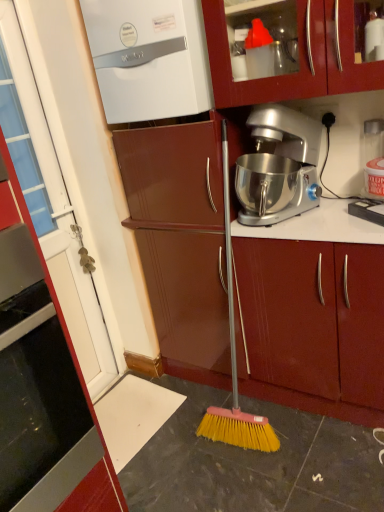
You are a GUI agent. You are given a task and a screenshot of the screen. Output one action in this format:
    pyautogui.click(x=<x>, y=<y>)
    Task: Click on the silver metallic stand mixer at center
    
    Given the screenshot: What is the action you would take?
    pyautogui.click(x=278, y=166)

The width and height of the screenshot is (384, 512). What do you see at coordinates (315, 325) in the screenshot?
I see `matte wood cabinet at center, placed as the 1th cabinetry when sorted from back to front` at bounding box center [315, 325].

This screenshot has height=512, width=384. I want to click on white glossy boiler at upper left, so click(149, 58).

Image resolution: width=384 pixels, height=512 pixels. I want to click on silver metallic stand mixer at center, so click(278, 166).

Is white glossy boiler at upper left oriented away from matte wood cabinet at center, the second cabinetry from the front?

No.

In the scene shown: Which of these two, white glossy boiler at upper left or matte wood cabinet at center, the first cabinetry in the right-to-left sequence, is thinner?

Thinner between the two is white glossy boiler at upper left.

From a real-world perspective, is white glossy boiler at upper left under matte wood cabinet at center, placed as the 1th cabinetry when sorted from back to front?

Actually, white glossy boiler at upper left is physically above matte wood cabinet at center, placed as the 1th cabinetry when sorted from back to front, in the real world.

Which object is wider, white glossy boiler at upper left or silver metallic stand mixer at center?

silver metallic stand mixer at center is wider.

From the image's perspective, which is above, white glossy boiler at upper left or silver metallic stand mixer at center?

white glossy boiler at upper left appears higher in the image.

What's the angular difference between white glossy boiler at upper left and silver metallic stand mixer at center's facing directions?

The angle between the facing direction of white glossy boiler at upper left and the facing direction of silver metallic stand mixer at center is 0.0707 degrees.

Is point (166, 15) positioned after point (268, 185)?

That is False.

From a real-world perspective, is matte wood cabinet at center, placed as the 1th cabinetry when sorted from back to front, above or below white glossy boiler at upper left?

matte wood cabinet at center, placed as the 1th cabinetry when sorted from back to front, is below white glossy boiler at upper left.

From the image's perspective, is matte wood cabinet at center, placed as the 1th cabinetry when sorted from back to front, above white glossy boiler at upper left?

No.

Between matte wood cabinet at center, placed as the 1th cabinetry when sorted from back to front, and white glossy boiler at upper left, which one has more height?

With more height is matte wood cabinet at center, placed as the 1th cabinetry when sorted from back to front.

Are matte wood cabinet at center, the second cabinetry from the front, and silver metallic stand mixer at center far apart?

Actually, matte wood cabinet at center, the second cabinetry from the front, and silver metallic stand mixer at center are a little close together.

Considering the positions of points (240, 297) and (301, 178), is point (240, 297) farther from camera compared to point (301, 178)?

That is True.

Based on their positions, is matte wood cabinet at center, which ranks as the 2th cabinetry in left-to-right order, located to the left or right of silver metallic stand mixer at center?

matte wood cabinet at center, which ranks as the 2th cabinetry in left-to-right order, is to the right of silver metallic stand mixer at center.

From a real-world perspective, is white glossy door at left, which is the 2th cabinetry in right-to-left order, on top of white glossy boiler at upper left?

No, from a real-world perspective, white glossy door at left, which is the 2th cabinetry in right-to-left order, is not on top of white glossy boiler at upper left.

Which is nearer, (105, 456) or (175, 85)?

Point (105, 456).

In terms of height, does white glossy door at left, arranged as the 1th cabinetry when viewed from the left, look taller or shorter compared to white glossy boiler at upper left?

Clearly, white glossy door at left, arranged as the 1th cabinetry when viewed from the left, is taller compared to white glossy boiler at upper left.

Is point (256, 239) positioned after point (94, 411)?

No, (256, 239) is in front of (94, 411).

In the scene shown: How much distance is there between matte wood cabinet at center, which ranks as the 2th cabinetry in left-to-right order, and white glossy door at left, which is the 2th cabinetry in right-to-left order?

matte wood cabinet at center, which ranks as the 2th cabinetry in left-to-right order, and white glossy door at left, which is the 2th cabinetry in right-to-left order, are 37.65 inches apart.

Can you tell me how much matte wood cabinet at center, the first cabinetry in the right-to-left sequence, and white glossy door at left, placed as the second cabinetry when sorted from back to front, differ in facing direction?

The angular difference between matte wood cabinet at center, the first cabinetry in the right-to-left sequence, and white glossy door at left, placed as the second cabinetry when sorted from back to front, is 89.4 degrees.

Considering the relative sizes of matte wood cabinet at center, the second cabinetry from the front, and white glossy door at left, which is the 2th cabinetry in right-to-left order, in the image provided, is matte wood cabinet at center, the second cabinetry from the front, shorter than white glossy door at left, which is the 2th cabinetry in right-to-left order,?

No, matte wood cabinet at center, the second cabinetry from the front, is not shorter than white glossy door at left, which is the 2th cabinetry in right-to-left order.

Is white glossy boiler at upper left in front of or behind white glossy door at left, which is the 2th cabinetry in right-to-left order, in the image?

white glossy boiler at upper left is behind white glossy door at left, which is the 2th cabinetry in right-to-left order.

Can you confirm if white glossy boiler at upper left is bigger than white glossy door at left, placed as the second cabinetry when sorted from back to front?

Yes.

Is white glossy boiler at upper left positioned far away from white glossy door at left, which is the 2th cabinetry in right-to-left order?

That's not correct — white glossy boiler at upper left is a little close to white glossy door at left, which is the 2th cabinetry in right-to-left order.

Identify the location of cabinetry on the right side of white glossy boiler at upper left. The image size is (384, 512). (315, 325).

Locate an element on the screen. home appliance behind the silver metallic stand mixer at center is located at coordinates (149, 58).

Which object lies nearer to the anchor point matte wood cabinet at center, which ranks as the 2th cabinetry in left-to-right order, white glossy door at left, which is the 2th cabinetry in right-to-left order, or white glossy boiler at upper left?

white glossy boiler at upper left lies closer to matte wood cabinet at center, which ranks as the 2th cabinetry in left-to-right order, than the other object.

Based on their spatial positions, is white glossy boiler at upper left or silver metallic stand mixer at center further from matte wood cabinet at center, the first cabinetry in the right-to-left sequence?

white glossy boiler at upper left lies further to matte wood cabinet at center, the first cabinetry in the right-to-left sequence, than the other object.

Looking at the image, which one is located closer to white glossy boiler at upper left, matte wood cabinet at center, placed as the 1th cabinetry when sorted from back to front, or white glossy door at left, arranged as the 1th cabinetry when viewed from the left?

matte wood cabinet at center, placed as the 1th cabinetry when sorted from back to front.

When comparing their distances from white glossy boiler at upper left, does white glossy door at left, which is the 2th cabinetry in right-to-left order, or matte wood cabinet at center, which ranks as the 2th cabinetry in left-to-right order, seem closer?

Among the two, matte wood cabinet at center, which ranks as the 2th cabinetry in left-to-right order, is located nearer to white glossy boiler at upper left.

From the picture: Looking at the image, which one is located further to matte wood cabinet at center, which ranks as the 2th cabinetry in left-to-right order, silver metallic stand mixer at center or white glossy door at left, placed as the second cabinetry when sorted from back to front?

Based on the image, white glossy door at left, placed as the second cabinetry when sorted from back to front, appears to be further to matte wood cabinet at center, which ranks as the 2th cabinetry in left-to-right order.

Considering their positions, is white glossy door at left, which is the 2th cabinetry in right-to-left order, positioned closer to white glossy boiler at upper left than silver metallic stand mixer at center?

Among the two, silver metallic stand mixer at center is located nearer to white glossy boiler at upper left.

From the image, which object appears to be farther from silver metallic stand mixer at center, white glossy door at left, placed as the second cabinetry when sorted from back to front, or matte wood cabinet at center, which ranks as the 2th cabinetry in left-to-right order?

white glossy door at left, placed as the second cabinetry when sorted from back to front, is further to silver metallic stand mixer at center.

Based on their spatial positions, is white glossy boiler at upper left or matte wood cabinet at center, the second cabinetry from the front, closer to silver metallic stand mixer at center?

matte wood cabinet at center, the second cabinetry from the front, is closer to silver metallic stand mixer at center.

Image resolution: width=384 pixels, height=512 pixels. In order to click on coffee maker between white glossy door at left, placed as the second cabinetry when sorted from back to front, and matte wood cabinet at center, the first cabinetry in the right-to-left sequence, in the horizontal direction in this screenshot , I will do `click(278, 166)`.

This screenshot has width=384, height=512. Identify the location of cabinetry that lies between white glossy boiler at upper left and matte wood cabinet at center, placed as the 1th cabinetry when sorted from back to front, from top to bottom. (73, 362).

Locate an element on the screen. This screenshot has width=384, height=512. coffee maker that lies between white glossy boiler at upper left and matte wood cabinet at center, the second cabinetry from the front, from top to bottom is located at coordinates (278, 166).

Locate an element on the screen. The width and height of the screenshot is (384, 512). coffee maker between white glossy boiler at upper left and white glossy door at left, placed as the second cabinetry when sorted from back to front, from top to bottom is located at coordinates (278, 166).